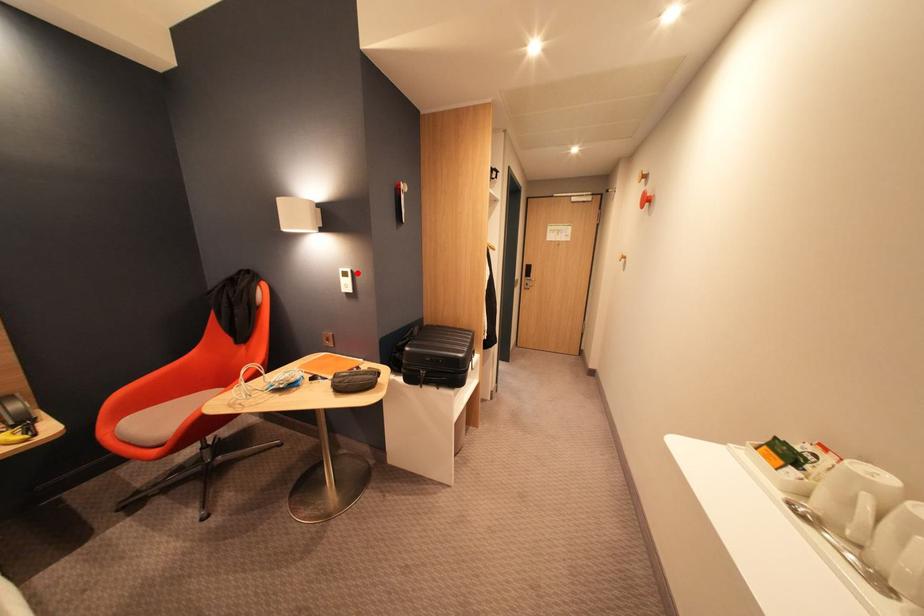
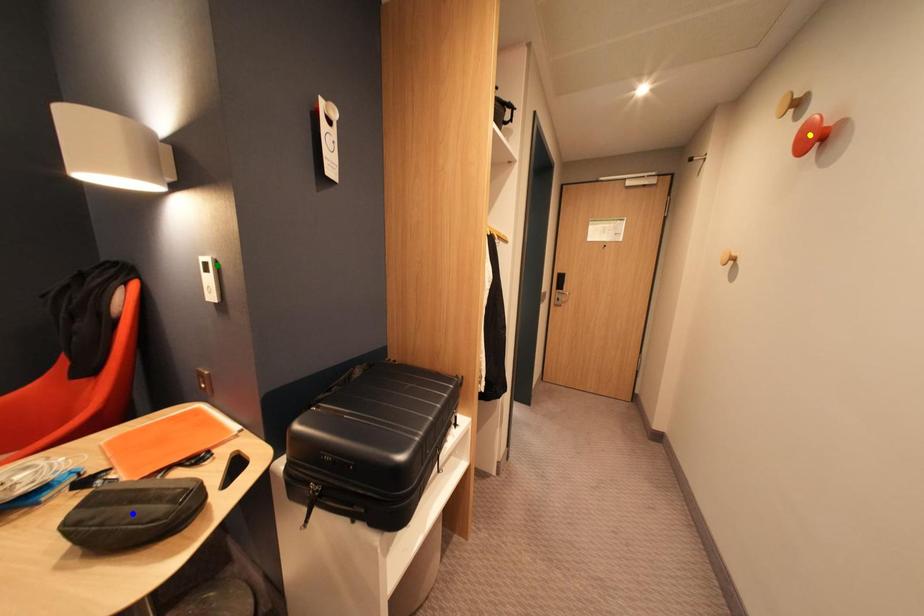
Question: I am providing you with two images of the same scene from different viewpoints. A red point is marked on the first image. You are given multiple points on the second image. Which point in image 2 is actually the same real-world point as the red point in image 1?

Choices:
 (A) yellow point
 (B) green point
 (C) blue point

Answer: (B)